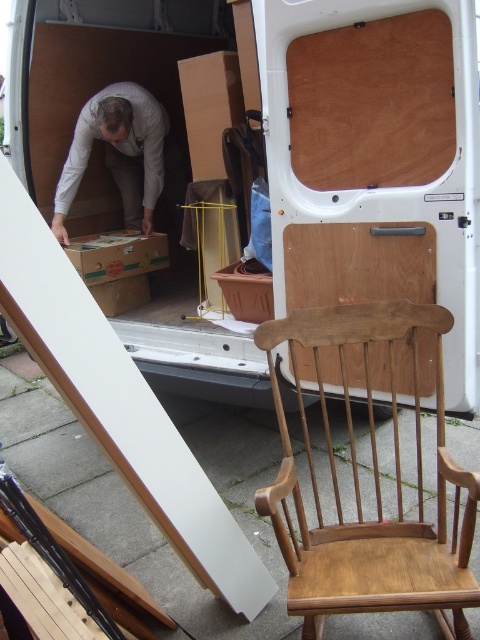
Question: Does light brown wooden rocking chair at center appear on the left side of wooden chair back at center?

Choices:
 (A) yes
 (B) no

Answer: (B)

Question: Is light brown wooden rocking chair at center closer to camera compared to gray fabric bag at center?

Choices:
 (A) yes
 (B) no

Answer: (A)

Question: Which object is the farthest from the light brown wooden rocking chair at center?

Choices:
 (A) wooden chair back at center
 (B) gray fabric bag at center

Answer: (B)

Question: Is light brown wooden rocking chair at center positioned in front of wooden chair back at center?

Choices:
 (A) no
 (B) yes

Answer: (B)

Question: Among these points, which one is nearest to the camera?

Choices:
 (A) (406, 305)
 (B) (316, 292)
 (C) (72, 193)

Answer: (A)

Question: Which object is farther from the camera taking this photo?

Choices:
 (A) light brown wooden rocking chair at center
 (B) gray fabric bag at center

Answer: (B)